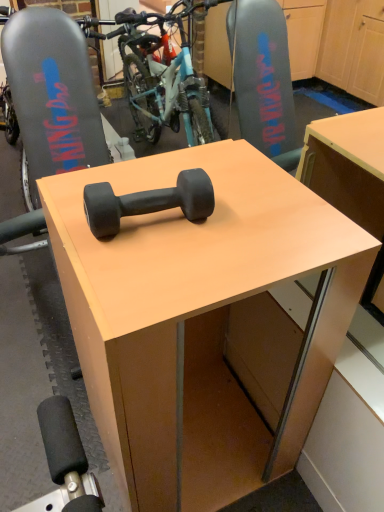
You are a GUI agent. You are given a task and a screenshot of the screen. Output one action in this format:
    pyautogui.click(x=<x>, y=<y>)
    Task: Click on the free point to the right of black rubber dumbbell at center
    The image size is (384, 512).
    Given the screenshot: What is the action you would take?
    pyautogui.click(x=244, y=225)